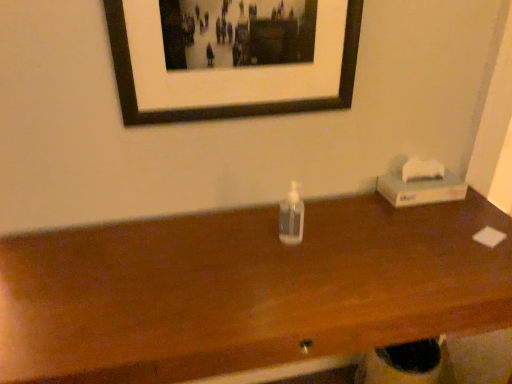
Question: Would you say transparent plastic bottle at center is a long distance from white cardboard tissue box at right?

Choices:
 (A) yes
 (B) no

Answer: (B)

Question: Does transparent plastic bottle at center come behind white cardboard tissue box at right?

Choices:
 (A) no
 (B) yes

Answer: (A)

Question: From a real-world perspective, is transparent plastic bottle at center physically above white cardboard tissue box at right?

Choices:
 (A) yes
 (B) no

Answer: (B)

Question: Is transparent plastic bottle at center located outside white cardboard tissue box at right?

Choices:
 (A) yes
 (B) no

Answer: (A)

Question: From the image's perspective, does transparent plastic bottle at center appear lower than white cardboard tissue box at right?

Choices:
 (A) no
 (B) yes

Answer: (B)

Question: Is white cardboard tissue box at right inside transparent plastic bottle at center?

Choices:
 (A) no
 (B) yes

Answer: (A)

Question: Does transparent plastic bottle at center have a lesser height compared to transparent plastic bottle at center?

Choices:
 (A) no
 (B) yes

Answer: (A)

Question: Could you tell me if transparent plastic bottle at center is facing transparent plastic bottle at center?

Choices:
 (A) no
 (B) yes

Answer: (A)

Question: From a real-world perspective, is transparent plastic bottle at center located beneath transparent plastic bottle at center?

Choices:
 (A) yes
 (B) no

Answer: (A)

Question: Is transparent plastic bottle at center surrounded by transparent plastic bottle at center?

Choices:
 (A) no
 (B) yes

Answer: (A)

Question: Can you confirm if transparent plastic bottle at center is wider than transparent plastic bottle at center?

Choices:
 (A) yes
 (B) no

Answer: (A)

Question: Is transparent plastic bottle at center positioned behind transparent plastic bottle at center?

Choices:
 (A) no
 (B) yes

Answer: (A)

Question: Does black matte picture frame at upper center touch white cardboard tissue box at right?

Choices:
 (A) no
 (B) yes

Answer: (A)